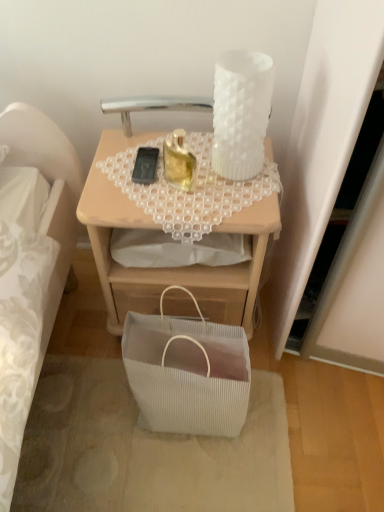
Question: Is white frosted glass candle holder at upper right, which appears as the 1th candle holder when viewed from the right, not near translucent glass candle at upper center, arranged as the first candle holder when viewed from the left?

Choices:
 (A) yes
 (B) no

Answer: (B)

Question: From the image's perspective, is white frosted glass candle holder at upper right, which appears as the 1th candle holder when viewed from the right, beneath translucent glass candle at upper center, arranged as the first candle holder when viewed from the left?

Choices:
 (A) yes
 (B) no

Answer: (B)

Question: From a real-world perspective, is white frosted glass candle holder at upper right, the 2th candle holder from the left, located higher than translucent glass candle at upper center, arranged as the second candle holder when viewed from the right?

Choices:
 (A) yes
 (B) no

Answer: (A)

Question: Is white frosted glass candle holder at upper right, the 2th candle holder from the left, positioned before translucent glass candle at upper center, arranged as the first candle holder when viewed from the left?

Choices:
 (A) yes
 (B) no

Answer: (A)

Question: Is white frosted glass candle holder at upper right, which appears as the 1th candle holder when viewed from the right, oriented away from translucent glass candle at upper center, arranged as the first candle holder when viewed from the left?

Choices:
 (A) no
 (B) yes

Answer: (A)

Question: From a real-world perspective, is white ribbed fabric bag at lower center physically located above or below white frosted glass candle holder at upper right, the 2th candle holder from the left?

Choices:
 (A) below
 (B) above

Answer: (A)

Question: Considering the positions of white ribbed fabric bag at lower center and white frosted glass candle holder at upper right, which appears as the 1th candle holder when viewed from the right, in the image, is white ribbed fabric bag at lower center taller or shorter than white frosted glass candle holder at upper right, which appears as the 1th candle holder when viewed from the right,?

Choices:
 (A) tall
 (B) short

Answer: (A)

Question: Considering the positions of white ribbed fabric bag at lower center and white frosted glass candle holder at upper right, which appears as the 1th candle holder when viewed from the right, in the image, is white ribbed fabric bag at lower center wider or thinner than white frosted glass candle holder at upper right, which appears as the 1th candle holder when viewed from the right,?

Choices:
 (A) thin
 (B) wide

Answer: (B)

Question: Which is correct: white ribbed fabric bag at lower center is inside white frosted glass candle holder at upper right, the 2th candle holder from the left, or outside of it?

Choices:
 (A) inside
 (B) outside

Answer: (B)

Question: Considering the positions of matte wooden desk at center and black matte mobile phone at center in the image, is matte wooden desk at center bigger or smaller than black matte mobile phone at center?

Choices:
 (A) big
 (B) small

Answer: (A)

Question: Which is correct: matte wooden desk at center is inside black matte mobile phone at center, or outside of it?

Choices:
 (A) inside
 (B) outside

Answer: (B)

Question: Considering the positions of matte wooden desk at center and black matte mobile phone at center in the image, is matte wooden desk at center wider or thinner than black matte mobile phone at center?

Choices:
 (A) wide
 (B) thin

Answer: (A)

Question: From the image's perspective, is matte wooden desk at center positioned above or below black matte mobile phone at center?

Choices:
 (A) below
 (B) above

Answer: (A)

Question: Would you say translucent glass candle at upper center, arranged as the first candle holder when viewed from the left, is inside or outside black matte mobile phone at center?

Choices:
 (A) outside
 (B) inside

Answer: (A)

Question: Considering the positions of translucent glass candle at upper center, arranged as the first candle holder when viewed from the left, and black matte mobile phone at center in the image, is translucent glass candle at upper center, arranged as the first candle holder when viewed from the left, bigger or smaller than black matte mobile phone at center?

Choices:
 (A) small
 (B) big

Answer: (B)